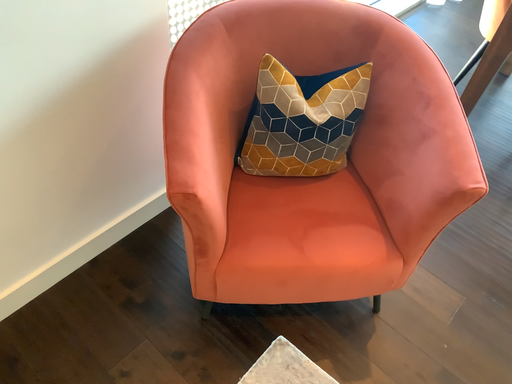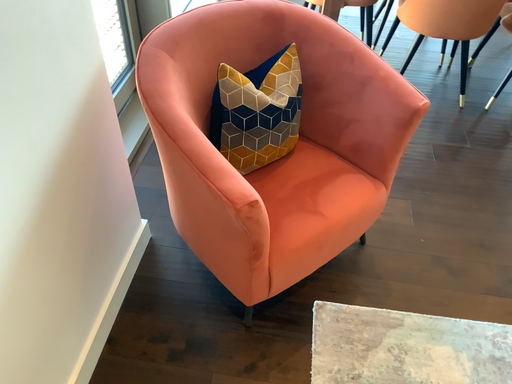
Question: Which way did the camera rotate in the video?

Choices:
 (A) rotated downward
 (B) rotated upward

Answer: (B)